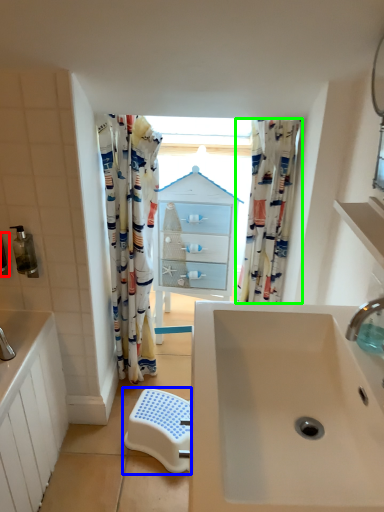
Question: Which is farther away from toiletry (highlighted by a red box)? step stool (highlighted by a blue box) or curtain (highlighted by a green box)?

Choices:
 (A) step stool
 (B) curtain

Answer: (B)